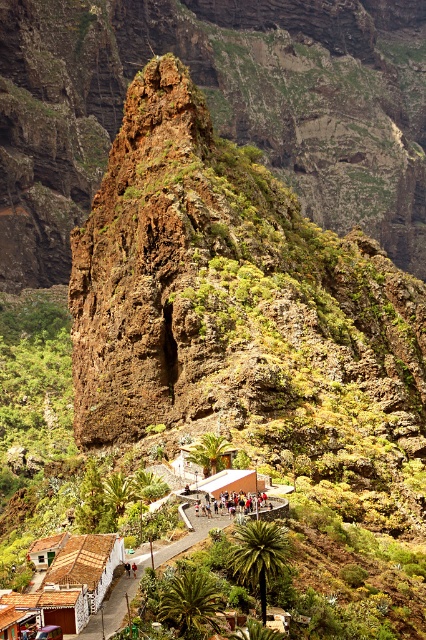
You are a delivery drone with a maximum flight range of 20 meters. You need to deliver a package from the brown wooden hut at lower left to the multicolored clothing at center. Can you complete the delivery without needing to recharge?

The distance between the brown wooden hut at lower left and the multicolored clothing at center is 18.51 meters, which is within your 20 meter range. Yes, you can complete the delivery without recharging.

You are standing at the bottom of the mountain and see the brown thatched roof hut at lower left and the multicolored clothing at center. Which object is positioned higher up the mountain?

The multicolored clothing at center is higher up the mountain than the brown thatched roof hut at lower left because the brown thatched roof hut at lower left is located below it.